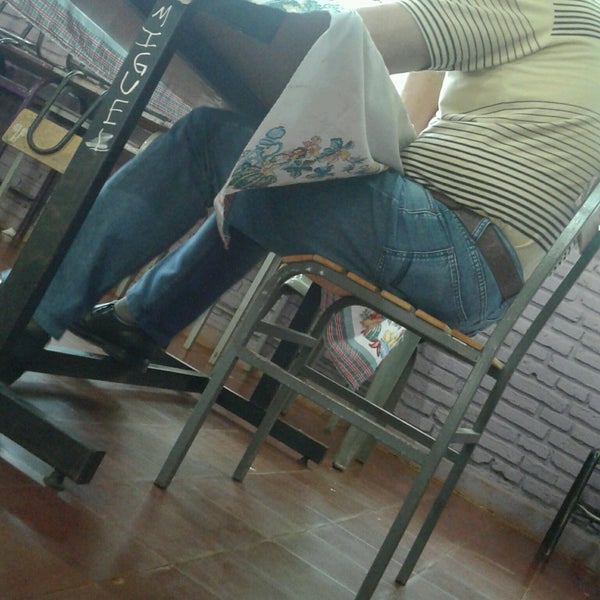
Find the location of a particular element. The height and width of the screenshot is (600, 600). orange tile is located at coordinates point(334,567).